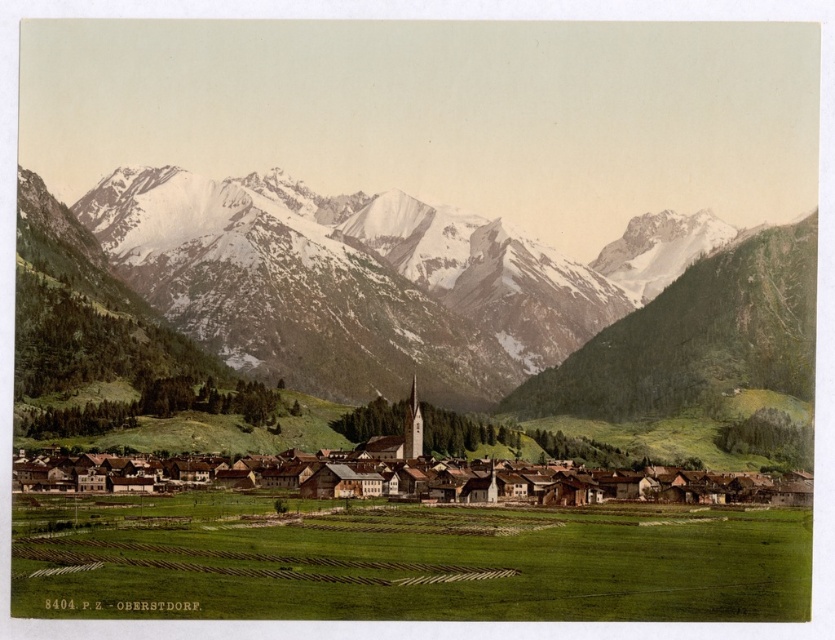
You are standing in the green field in front of the village and want to take a photo of both the brown wooden houses at center and the snowy granite mountains at upper center. Which object should you position to your left side in the camera frame to include both in the photo?

To include both the brown wooden houses at center and the snowy granite mountains at upper center in the photo, you should position the snowy granite mountains at upper center to your left side in the camera frame since they are located to the left of the brown wooden houses at center.

What are the coordinates of the snowy granite mountains at upper center in the image?

The snowy granite mountains at upper center are located at coordinates point (446, 291).

You are a hiker standing at the base of the snowy granite mountains at upper center. You want to reach the summit. Given that your average hiking pace is 2 miles per hour, and assuming the trail is straight and you hike nonstop, how long would it take you to reach the summit?

The snowy granite mountains at upper center are 2101.16 feet away from the viewer. Converting feet to miles, 2101.16 feet is approximately 0.4 miles. At a pace of 2 miles per hour, it would take roughly 12 minutes to reach the summit.